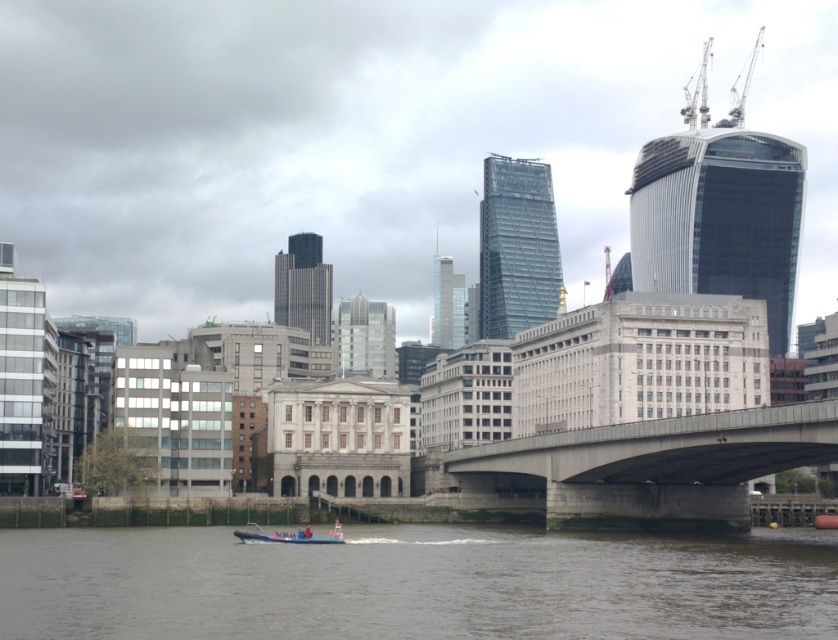
Which of these two, brown water at lower center or blue rubber boat at lower center, stands taller?

brown water at lower center is taller.

Is point (790, 570) positioned behind point (308, 532)?

No.

Identify the location of brown water at lower center. The height and width of the screenshot is (640, 838). (415, 584).

In the scene shown: Is concrete bridge at center thinner than blue rubber boat at lower center?

In fact, concrete bridge at center might be wider than blue rubber boat at lower center.

Is concrete bridge at center positioned behind blue rubber boat at lower center?

No, concrete bridge at center is closer to the viewer.

Is point (538, 442) farther from viewer compared to point (299, 536)?

That is True.

You are a GUI agent. You are given a task and a screenshot of the screen. Output one action in this format:
    pyautogui.click(x=<x>, y=<y>)
    Task: Click on the concrete bridge at center
    The image size is (838, 640).
    Given the screenshot: What is the action you would take?
    pyautogui.click(x=653, y=467)

Between brown water at lower center and concrete bridge at center, which one has less height?

brown water at lower center is shorter.

Does point (738, 550) come closer to viewer compared to point (492, 470)?

Yes, point (738, 550) is in front of point (492, 470).

Locate an element on the screen. brown water at lower center is located at coordinates 415,584.